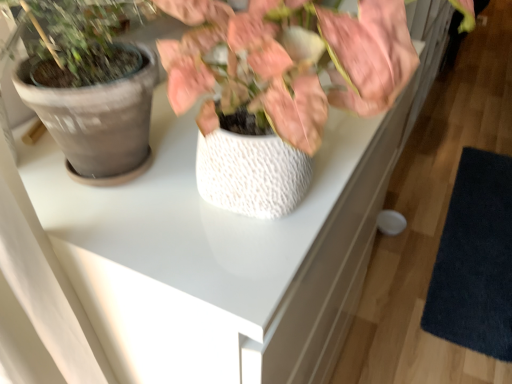
Question: In the image, is white textured pot at center positioned in front of or behind dark blue textured mat at lower right?

Choices:
 (A) behind
 (B) front

Answer: (B)

Question: Considering the positions of white textured pot at center and dark blue textured mat at lower right in the image, is white textured pot at center wider or thinner than dark blue textured mat at lower right?

Choices:
 (A) wide
 (B) thin

Answer: (B)

Question: In terms of size, does white textured pot at center appear bigger or smaller than dark blue textured mat at lower right?

Choices:
 (A) big
 (B) small

Answer: (B)

Question: In terms of size, does dark blue textured mat at lower right appear bigger or smaller than white textured pot at center?

Choices:
 (A) small
 (B) big

Answer: (B)

Question: Is dark blue textured mat at lower right inside or outside of white textured pot at center?

Choices:
 (A) outside
 (B) inside

Answer: (A)

Question: From the image's perspective, is dark blue textured mat at lower right located above or below white textured pot at center?

Choices:
 (A) below
 (B) above

Answer: (A)

Question: In terms of width, does dark blue textured mat at lower right look wider or thinner when compared to white textured pot at center?

Choices:
 (A) thin
 (B) wide

Answer: (B)